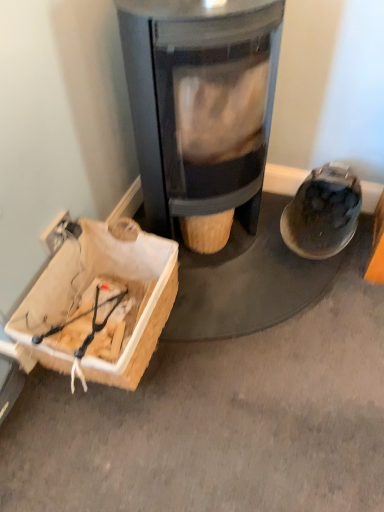
What are the coordinates of `vacant point to the left of matte black shoe at right` in the screenshot? It's located at (252, 256).